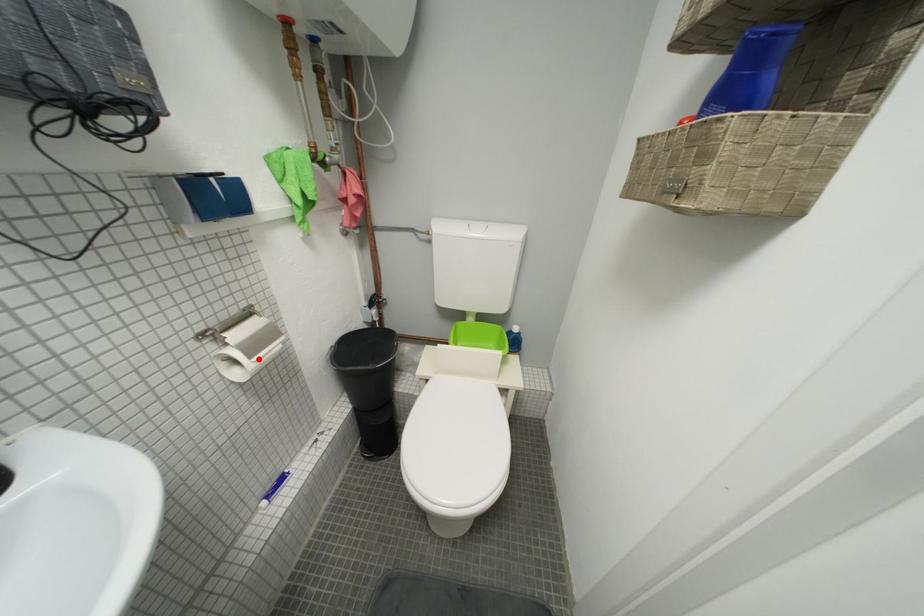
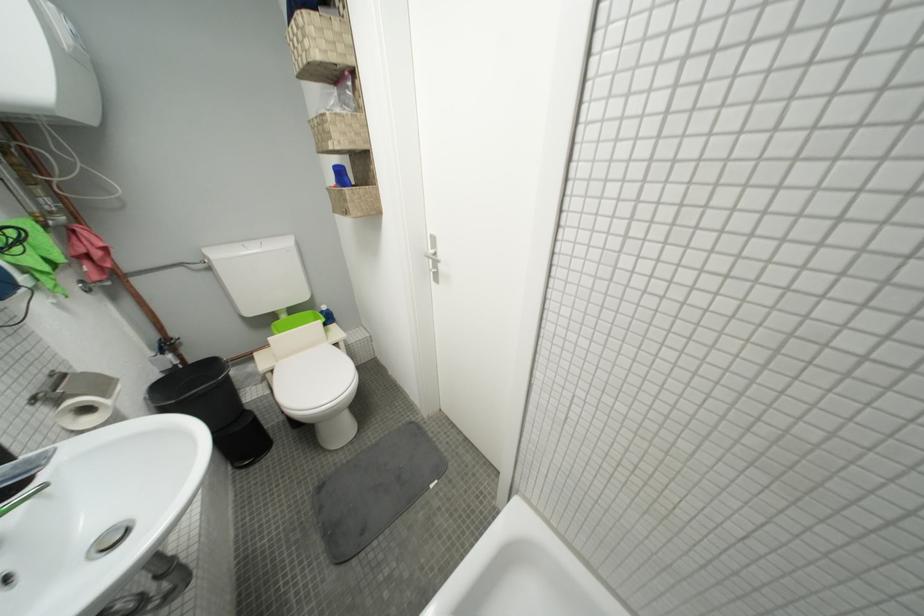
Where in the second image is the point corresponding to the highlighted location from the first image?

(113, 397)